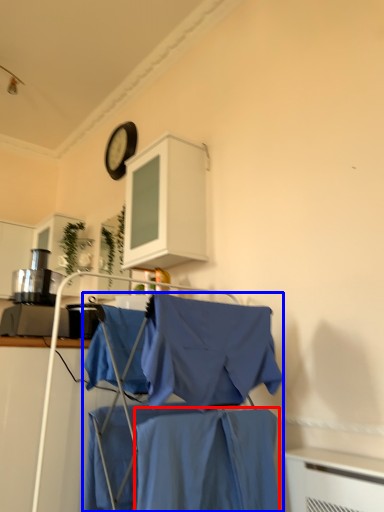
Question: Which of the following is the farthest to the observer, fabric (highlighted by a red box) or laundry (highlighted by a blue box)?

Choices:
 (A) fabric
 (B) laundry

Answer: (B)